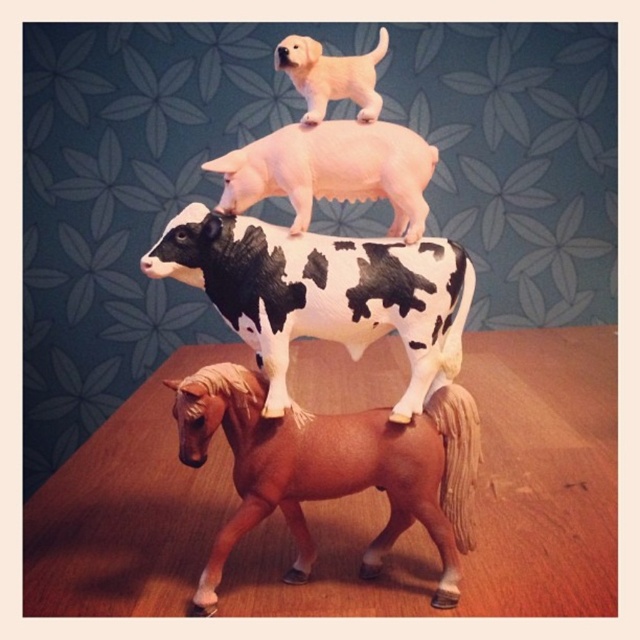
Which of these two, brown matte horse at bottom or light brown matte pony at upper center, stands shorter?

Standing shorter between the two is light brown matte pony at upper center.

How much distance is there between brown matte horse at bottom and light brown matte pony at upper center?

The distance of brown matte horse at bottom from light brown matte pony at upper center is 16.57 inches.

Is point (449, 518) farther from camera compared to point (307, 90)?

No, it is in front of (307, 90).

Locate an element on the screen. brown matte horse at bottom is located at coordinates (332, 468).

In the scene shown: Can you confirm if wooden table at center is smaller than black and white spotted cow at center?

No, wooden table at center is not smaller than black and white spotted cow at center.

Can you confirm if wooden table at center is positioned to the left of black and white spotted cow at center?

In fact, wooden table at center is to the right of black and white spotted cow at center.

Which is in front, point (465, 376) or point (397, 275)?

Positioned in front is point (397, 275).

What are the coordinates of `wooden table at center` in the screenshot? It's located at (481, 500).

Does point (296, 230) come farther from viewer compared to point (333, 58)?

No, it is in front of (333, 58).

Where is `white matte pig at upper center`? Image resolution: width=640 pixels, height=640 pixels. white matte pig at upper center is located at coordinates (332, 170).

In order to click on white matte pig at upper center in this screenshot , I will do `click(332, 170)`.